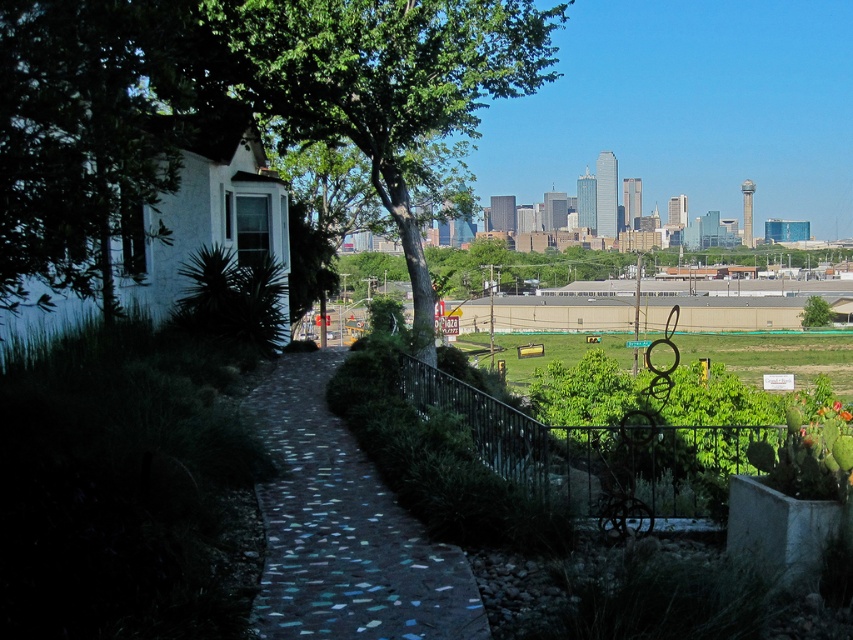
You are a visitor exploring the garden and want to take a photo of both the green leafy tree at center and the green leafy tree at upper center. Which tree should you stand closer to in order to include both in your camera frame?

You should stand closer to the green leafy tree at upper center because it is smaller in size compared to the green leafy tree at center. By positioning yourself closer to the smaller tree, you can better balance their sizes in the frame, ensuring both are visible and well composed.

You are a gardener planning to plant flowers between the green leafy tree at center and the mosaic stone path at center. Considering their widths, which object should you place the flowers closer to to ensure they have enough space to grow?

The green leafy tree at center is wider than the mosaic stone path at center, so you should place the flowers closer to the mosaic stone path at center to ensure they have enough space to grow.